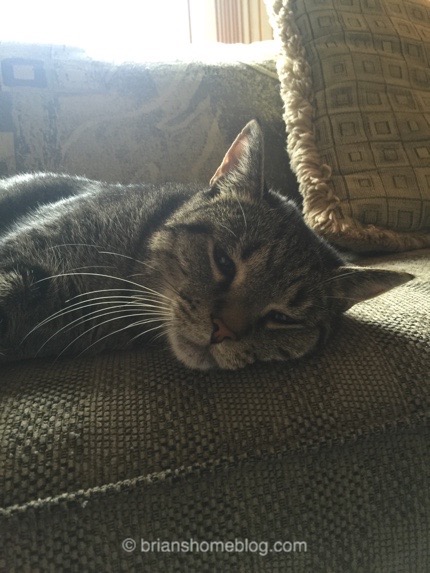
Identify the location of couch. (355, 394).